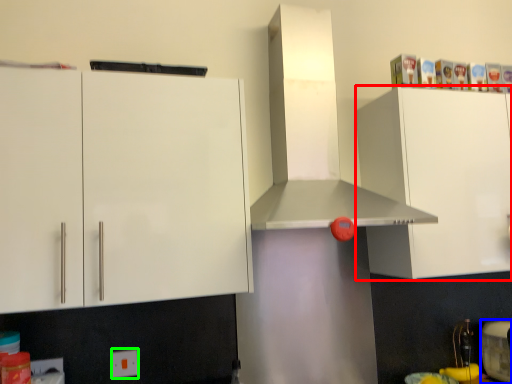
Question: Considering the real-world distances, which object is farthest from cabinetry (highlighted by a red box)? appliance (highlighted by a blue box) or electric outlet (highlighted by a green box)?

Choices:
 (A) appliance
 (B) electric outlet

Answer: (B)